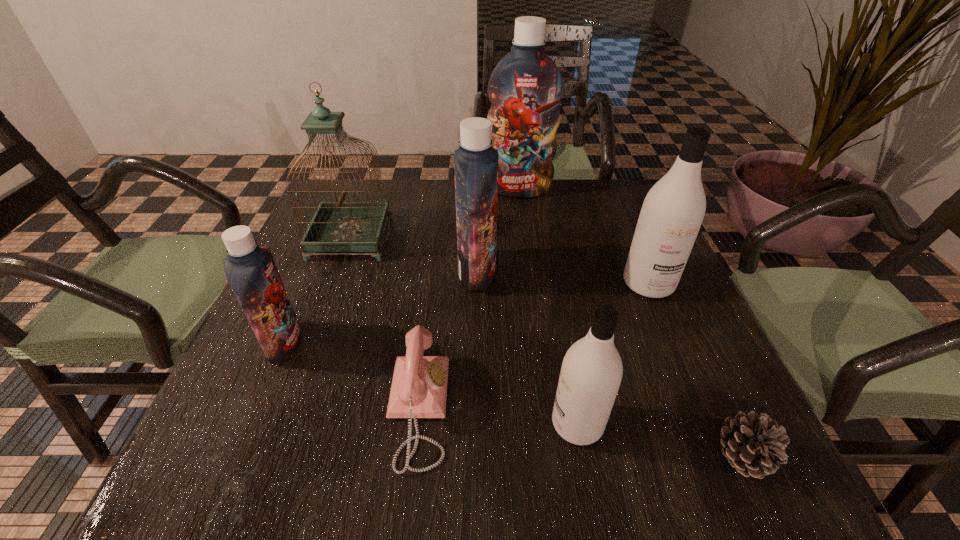
At what (x,y) coordinates should I click in order to perform the action: click on the second shortest object. Please return your answer as a coordinate pair (x, y). The image size is (960, 540). Looking at the image, I should click on (419, 386).

The image size is (960, 540). In order to click on the sixth object from right to left in this screenshot , I will do `click(419, 386)`.

This screenshot has width=960, height=540. In order to click on pinecone in this screenshot , I will do `click(755, 445)`.

At what (x,y) coordinates should I click in order to perform the action: click on vacant space located 0.400m on the front label of the tallest shampoo. Please return your answer as a coordinate pair (x, y). This screenshot has height=540, width=960. Looking at the image, I should click on (533, 298).

The width and height of the screenshot is (960, 540). In order to click on free space located 0.080m at the door of the birdcage in this screenshot , I will do `click(419, 238)`.

Find the location of `free space located on the front label of the second nearest blue shampoo`. free space located on the front label of the second nearest blue shampoo is located at coordinates (534, 272).

Locate an element on the screen. The image size is (960, 540). vacant region located 0.320m on the front-facing side of the bigger white shampoo is located at coordinates (713, 440).

Where is `vacant area located on the front label of the smallest blue shampoo`? The image size is (960, 540). vacant area located on the front label of the smallest blue shampoo is located at coordinates (427, 343).

This screenshot has width=960, height=540. In order to click on free space located 0.130m on the front-facing side of the left white shampoo in this screenshot , I will do `click(474, 423)`.

Identify the location of vacant space located on the front-facing side of the left white shampoo. (397, 423).